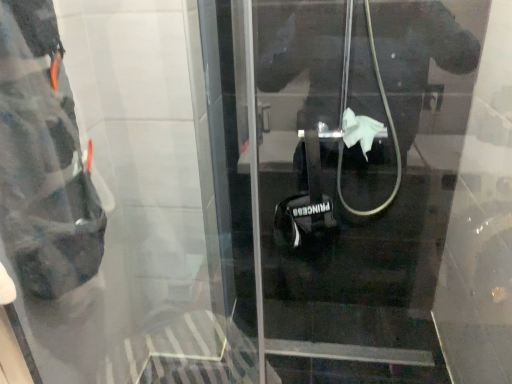
Based on the photo, measure the distance between point (x=57, y=207) and camera.

Point (x=57, y=207) and camera are 3.31 feet apart.

Measure the distance between black matte bag at left and camera.

black matte bag at left and camera are 29.09 inches apart.

Identify the location of black matte bag at left. (42, 159).

What do you see at coordinates (42, 159) in the screenshot?
I see `black matte bag at left` at bounding box center [42, 159].

Find the location of `transparent plastic door at center`. transparent plastic door at center is located at coordinates (353, 178).

In order to face transparent plastic door at center, should I rotate leftwards or rightwards?

Turn left approximately 0.980 degrees to face it.

What do you see at coordinates (353, 178) in the screenshot? The image size is (512, 384). I see `transparent plastic door at center` at bounding box center [353, 178].

Identify the location of black matte bag at left. (42, 159).

Which object is positioned more to the right, black matte bag at left or transparent plastic door at center?

transparent plastic door at center is more to the right.

Based on the photo, is the position of black matte bag at left more distant than that of transparent plastic door at center?

Yes, black matte bag at left is further from the viewer.

Which is further, (15, 218) or (369, 270)?

Point (369, 270)

From the image's perspective, which object appears higher, black matte bag at left or transparent plastic door at center?

black matte bag at left appears higher in the image.

From a real-world perspective, who is located lower, black matte bag at left or transparent plastic door at center?

transparent plastic door at center is physically lower.

In terms of width, does black matte bag at left look wider or thinner when compared to transparent plastic door at center?

Considering their sizes, black matte bag at left looks broader than transparent plastic door at center.

Considering the relative sizes of black matte bag at left and transparent plastic door at center in the image provided, is black matte bag at left shorter than transparent plastic door at center?

Correct, black matte bag at left is not as tall as transparent plastic door at center.

Considering the relative sizes of black matte bag at left and transparent plastic door at center in the image provided, is black matte bag at left smaller than transparent plastic door at center?

Yes.

Is transparent plastic door at center located within black matte bag at left?

Actually, transparent plastic door at center is outside black matte bag at left.

Would you consider black matte bag at left to be distant from transparent plastic door at center?

No, black matte bag at left is not far from transparent plastic door at center.

Looking at this image, is black matte bag at left oriented away from transparent plastic door at center?

black matte bag at left does not have its back to transparent plastic door at center.

How many degrees apart are the facing directions of black matte bag at left and transparent plastic door at center?

90 degrees separate the facing orientations of black matte bag at left and transparent plastic door at center.

Locate an element on the screen. Image resolution: width=512 pixels, height=384 pixels. door to the right of black matte bag at left is located at coordinates (353, 178).

Which is more to the left, transparent plastic door at center or black matte bag at left?

From the viewer's perspective, black matte bag at left appears more on the left side.

Is transparent plastic door at center positioned before black matte bag at left?

Yes, it is.

Which is behind, point (309, 207) or point (42, 105)?

The point (309, 207) is farther.

From the image's perspective, who appears lower, transparent plastic door at center or black matte bag at left?

transparent plastic door at center, from the image's perspective.

From a real-world perspective, between transparent plastic door at center and black matte bag at left, who is vertically higher?

In real-world perspective, black matte bag at left is above.

Considering the relative sizes of transparent plastic door at center and black matte bag at left in the image provided, is transparent plastic door at center thinner than black matte bag at left?

Indeed, transparent plastic door at center has a lesser width compared to black matte bag at left.

From their relative heights in the image, would you say transparent plastic door at center is taller or shorter than black matte bag at left?

Considering their sizes, transparent plastic door at center has more height than black matte bag at left.

From the picture: Considering the sizes of transparent plastic door at center and black matte bag at left in the image, is transparent plastic door at center bigger or smaller than black matte bag at left?

Considering their sizes, transparent plastic door at center takes up more space than black matte bag at left.

Is transparent plastic door at center positioned beyond the bounds of black matte bag at left?

Yes.

Is transparent plastic door at center not near black matte bag at left?

transparent plastic door at center is near black matte bag at left, not far away.

Is transparent plastic door at center aimed at black matte bag at left?

No, transparent plastic door at center is not oriented towards black matte bag at left.

What's the angular difference between transparent plastic door at center and black matte bag at left's facing directions?

90 degrees.

Where is `wide above the transparent plastic door at center (from the image's perspective)`? This screenshot has height=384, width=512. wide above the transparent plastic door at center (from the image's perspective) is located at coordinates (42, 159).

Find the location of a particular element. The width and height of the screenshot is (512, 384). wide that is behind the transparent plastic door at center is located at coordinates 42,159.

Locate an element on the screen. The height and width of the screenshot is (384, 512). door that is in front of the black matte bag at left is located at coordinates (353, 178).